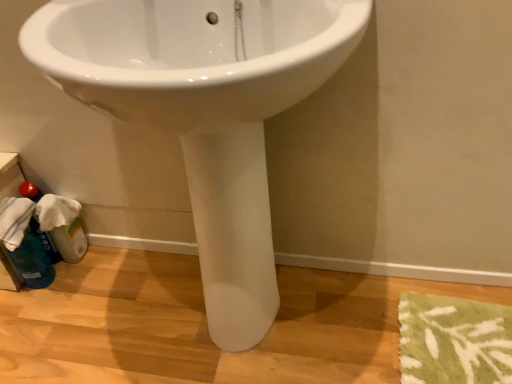
Image resolution: width=512 pixels, height=384 pixels. What do you see at coordinates (205, 111) in the screenshot?
I see `white glossy sink at center` at bounding box center [205, 111].

Where is `white glossy sink at center`? The image size is (512, 384). white glossy sink at center is located at coordinates (205, 111).

Where is `white glossy sink at center`? The width and height of the screenshot is (512, 384). white glossy sink at center is located at coordinates (205, 111).